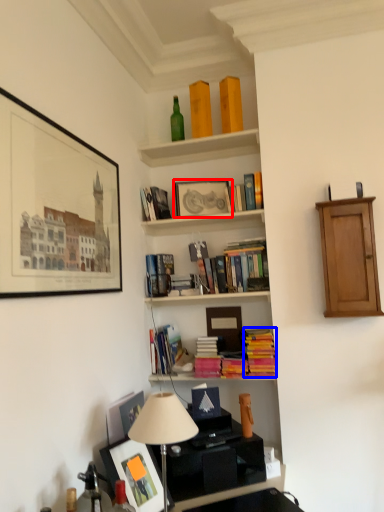
Question: Which point is further to the camera, picture frame (highlighted by a red box) or book (highlighted by a blue box)?

Choices:
 (A) picture frame
 (B) book

Answer: (A)